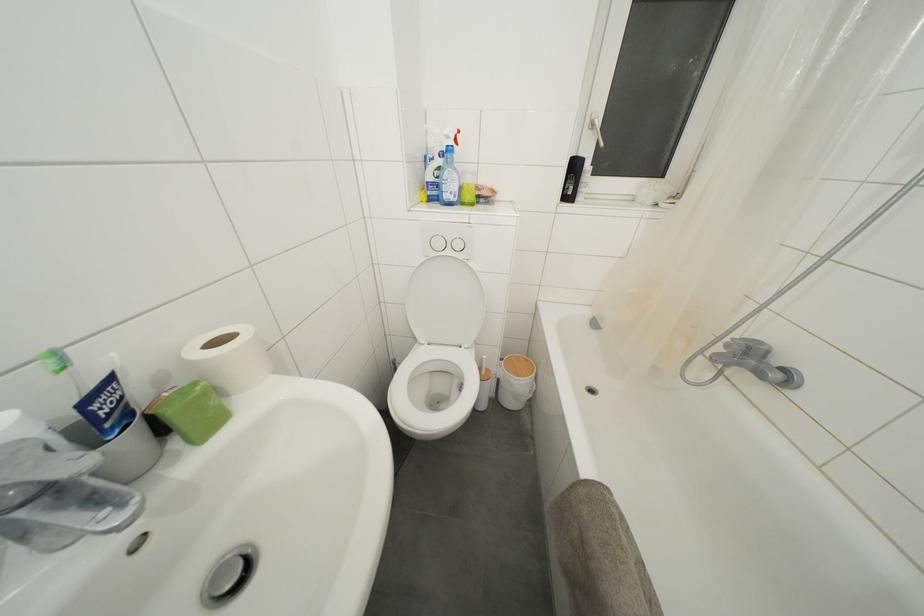
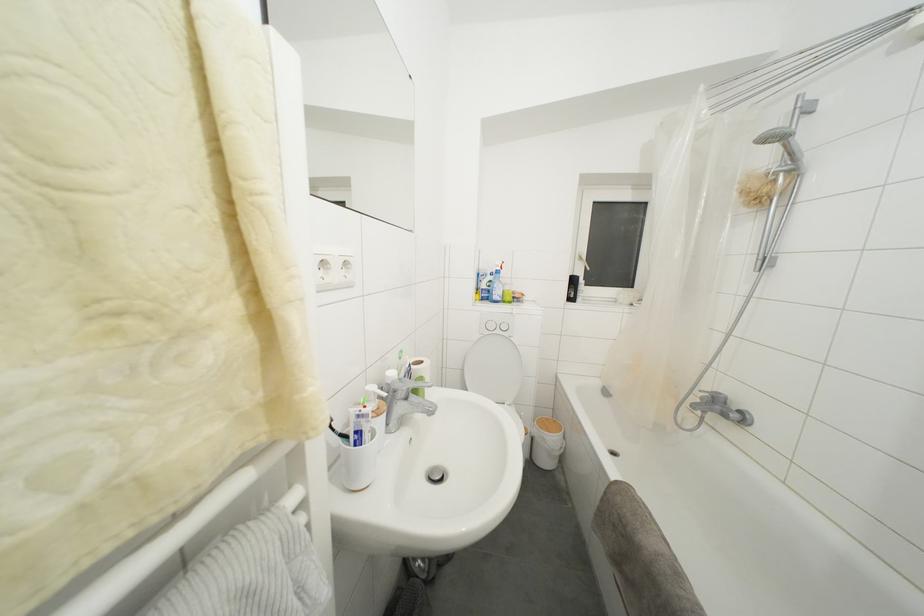
Question: The first image is from the beginning of the video and the second image is from the end. How did the camera likely rotate when shooting the video?

Choices:
 (A) Left
 (B) Right
 (C) Up
 (D) Down

Answer: (C)